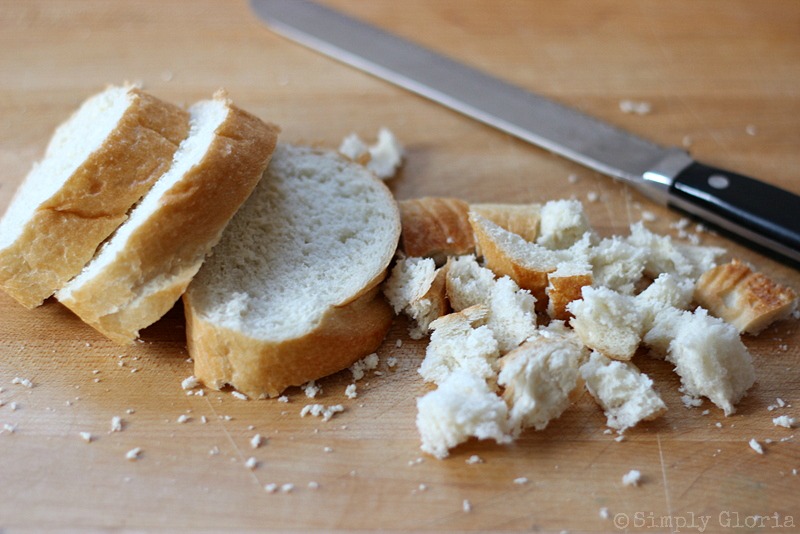
Locate an element on the screen. The image size is (800, 534). crumb is located at coordinates (630, 480).